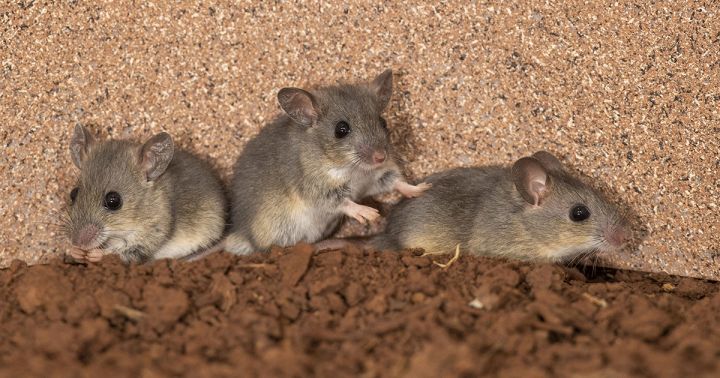
Locate an element on the screen. This screenshot has width=720, height=378. bedding is located at coordinates (256, 302).